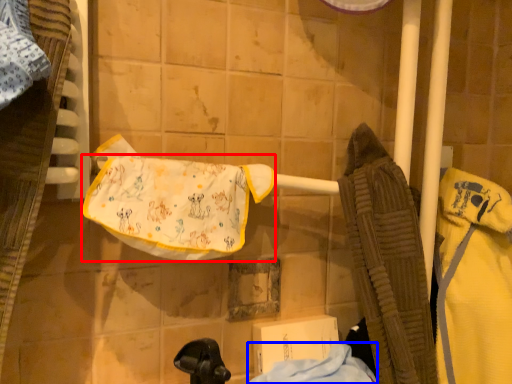
Question: Which object is closer to the camera taking this photo, underclothes (highlighted by a red box) or cloth (highlighted by a blue box)?

Choices:
 (A) underclothes
 (B) cloth

Answer: (B)